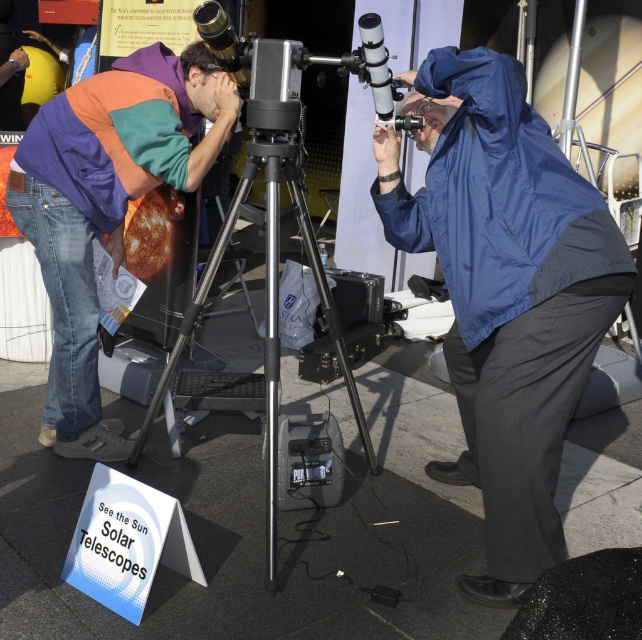
You are attending a solar observation event and want to set up a small table between the blue smooth jacket at center and the silver metallic tripod at center. Considering their widths, will the table fit if it requires 1 meter of space between them?

The blue smooth jacket at center is narrower than the silver metallic tripod at center. Since the table requires 1 meter of space between them, it depends on the actual distance between the two objects. However, the description only provides information about their widths, not the distance between them. Without knowing the distance, we cannot determine if the table will fit.

You are a visitor at the event and want to adjust the solar telescope mounted on the silver metallic tripod at center. However, you notice the blue smooth jacket at center is blocking access. Can you move the jacket to access the tripod?

The blue smooth jacket at center is positioned over silver metallic tripod at center, so you can move the jacket to access the tripod since it is covering the tripod and not attached to it.

You are a participant at the solar telescope event and need to move from your current position near the multicolored fleece jacket at left to the blue smooth jacket at center. The path is clear, but you must carry a 1.2 meter long telescope tube. Will the telescope tube fit through the space between the two jackets?

The distance between the multicolored fleece jacket at left and blue smooth jacket at center is 1.05 meters. Since the telescope tube is 1.2 meters long, it will not fit through the space as the tube is longer than the available distance.